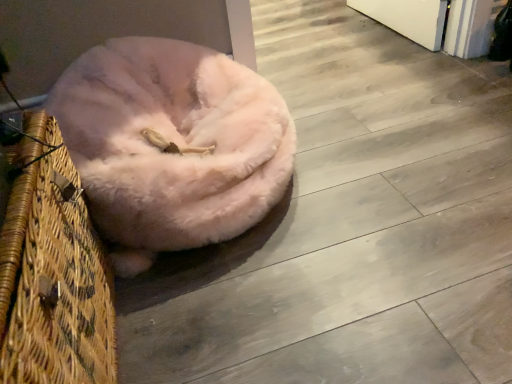
Question: Considering the positions of woven straw basket at left and fuzzy pink dog bed at center in the image, is woven straw basket at left bigger or smaller than fuzzy pink dog bed at center?

Choices:
 (A) big
 (B) small

Answer: (B)

Question: Based on their positions, is woven straw basket at left located to the left or right of fuzzy pink dog bed at center?

Choices:
 (A) left
 (B) right

Answer: (A)

Question: Considering the positions of point (61, 201) and point (269, 137), is point (61, 201) closer or farther from the camera than point (269, 137)?

Choices:
 (A) farther
 (B) closer

Answer: (B)

Question: In the image, is fuzzy pink dog bed at center on the left side or the right side of woven straw basket at left?

Choices:
 (A) right
 (B) left

Answer: (A)

Question: From the image's perspective, is fuzzy pink dog bed at center located above or below woven straw basket at left?

Choices:
 (A) below
 (B) above

Answer: (B)

Question: Looking at the image, does fuzzy pink dog bed at center seem bigger or smaller compared to woven straw basket at left?

Choices:
 (A) big
 (B) small

Answer: (A)

Question: Considering the positions of fuzzy pink dog bed at center and woven straw basket at left in the image, is fuzzy pink dog bed at center wider or thinner than woven straw basket at left?

Choices:
 (A) thin
 (B) wide

Answer: (B)